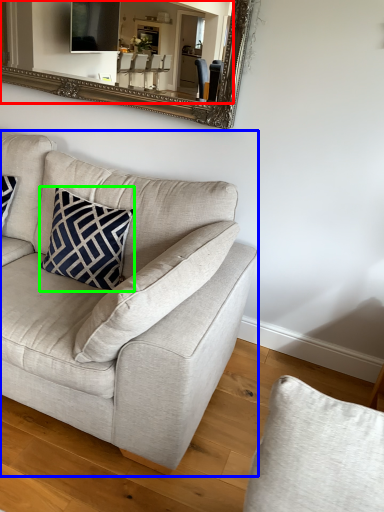
Question: Which object is positioned farthest from mirror (highlighted by a red box)? Select from studio couch (highlighted by a blue box) and pillow (highlighted by a green box).

Choices:
 (A) studio couch
 (B) pillow

Answer: (A)